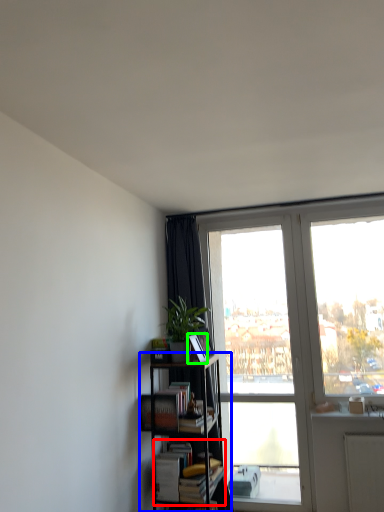
Question: Which is farther away from book (highlighted by a red box)? bookcase (highlighted by a blue box) or paperback book (highlighted by a green box)?

Choices:
 (A) bookcase
 (B) paperback book

Answer: (B)